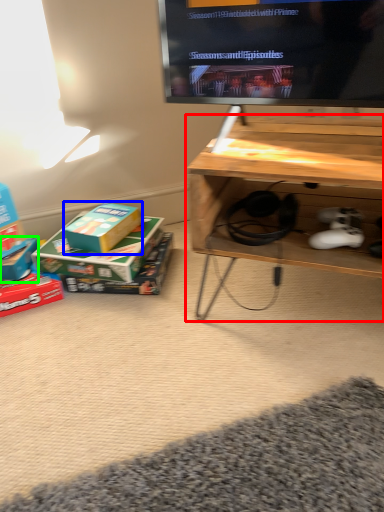
Question: Based on their relative distances, which object is farther from table (highlighted by a red box)? Choose from box (highlighted by a blue box) and box (highlighted by a green box).

Choices:
 (A) box
 (B) box

Answer: (B)